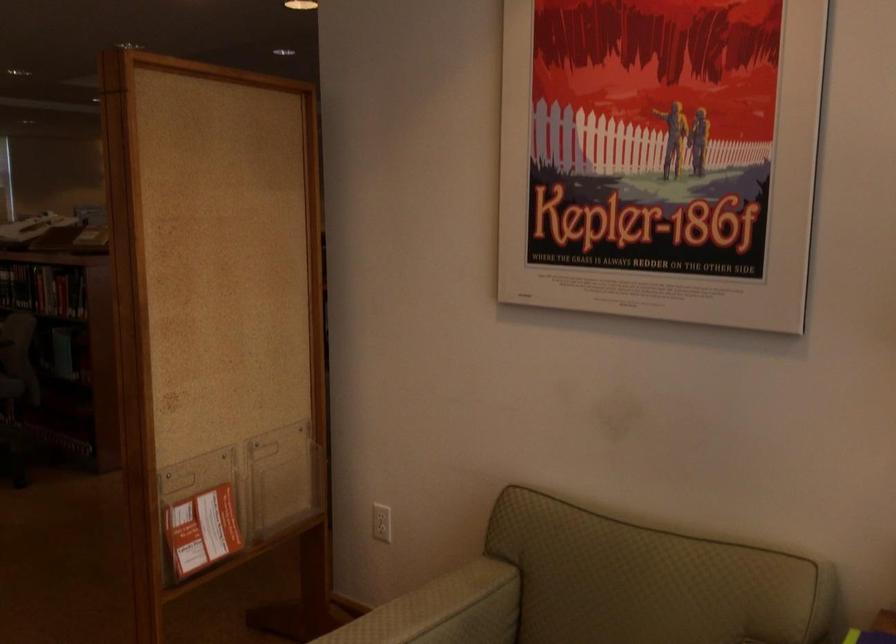
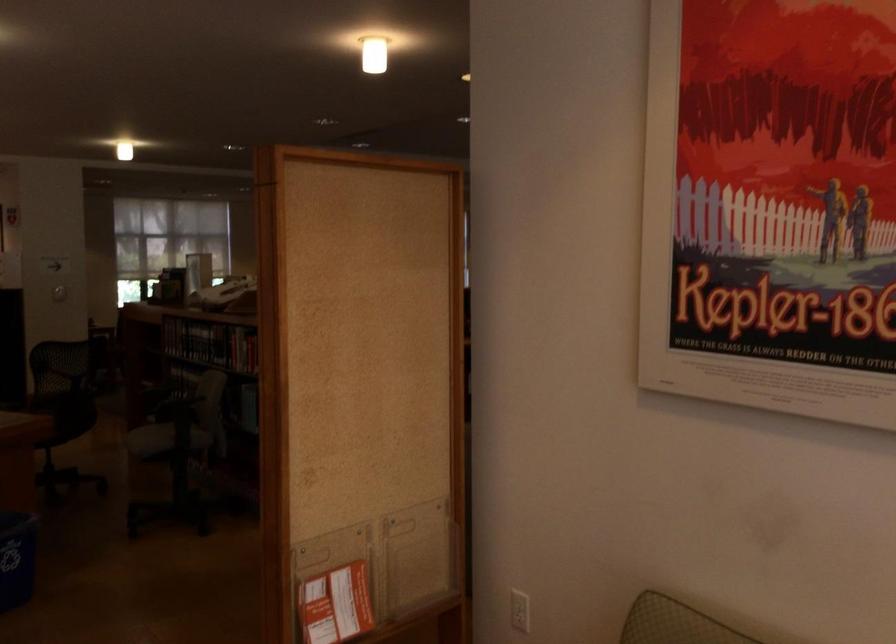
Locate, in the second image, the point that corresponds to point (204, 532) in the first image.

(336, 605)